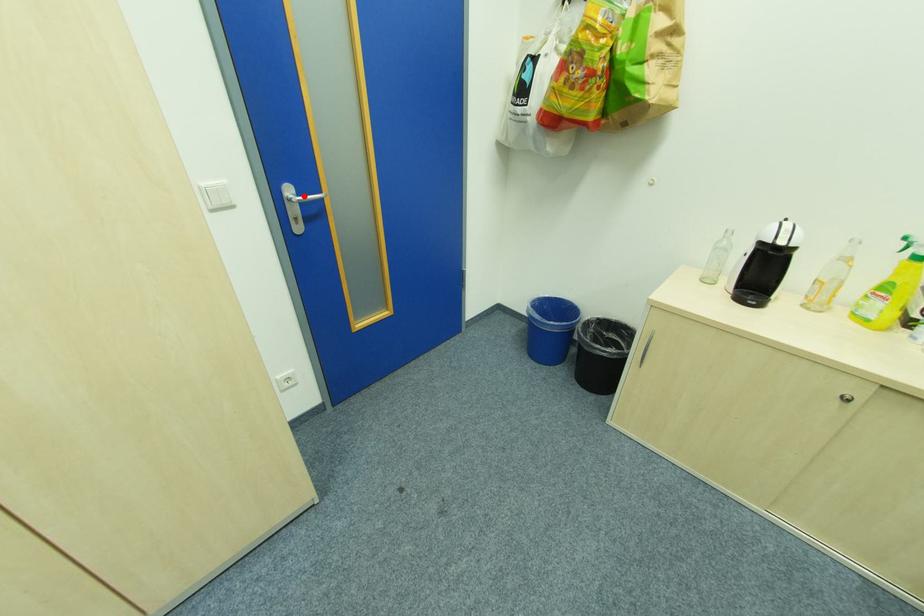
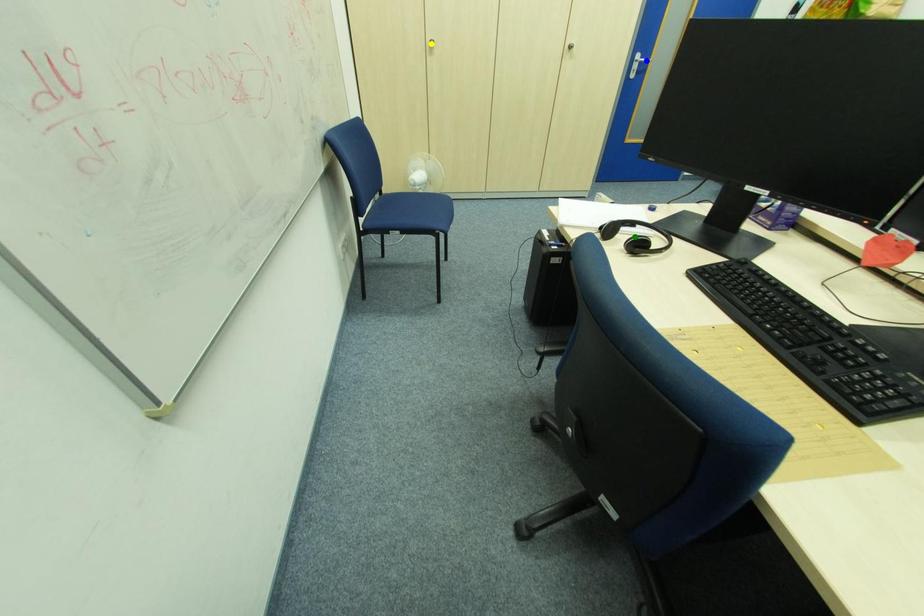
Question: I am providing you with two images of the same scene from different viewpoints. A red point is marked on the first image. You are given multiple points on the second image. Which point in image 2 represents the same 3d spot as the red point in image 1?

Choices:
 (A) blue point
 (B) green point
 (C) yellow point

Answer: (A)